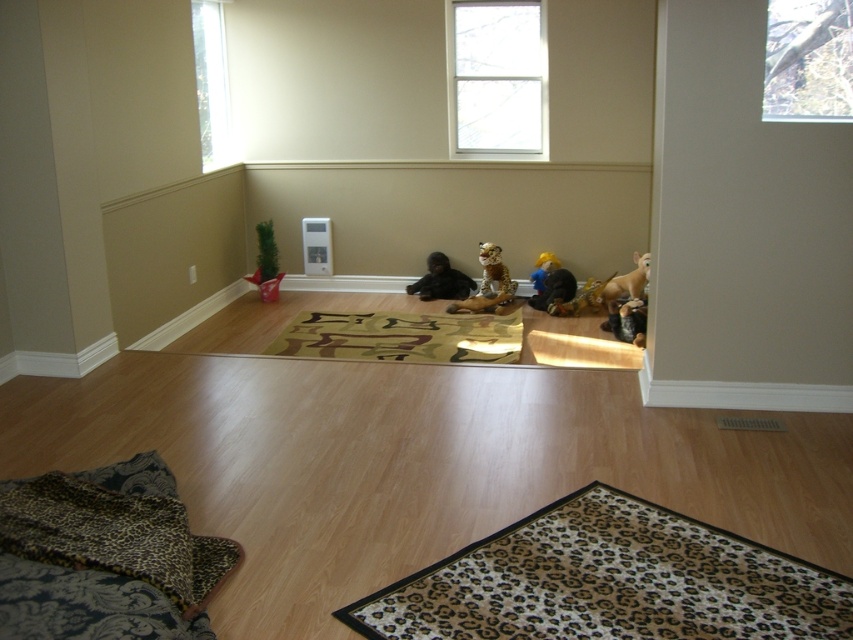
Does leopard print fabric at lower left have a lesser width compared to plush yellow bear at center?

In fact, leopard print fabric at lower left might be wider than plush yellow bear at center.

Who is more forward, [84,540] or [553,262]?

Point [84,540] is more forward.

Where is `leopard print fabric at lower left`? leopard print fabric at lower left is located at coordinates (103, 556).

Image resolution: width=853 pixels, height=640 pixels. Identify the location of clear glass window at upper left. (212, 83).

Which is below, clear glass window at upper left or leopard print plush toy at center?

leopard print plush toy at center is lower down.

Image resolution: width=853 pixels, height=640 pixels. I want to click on clear glass window at upper left, so click(x=212, y=83).

Can you confirm if leopard print fabric at lower left is positioned to the left of black plush monkey at center?

Correct, you'll find leopard print fabric at lower left to the left of black plush monkey at center.

Locate an element on the screen. leopard print fabric at lower left is located at coordinates (103, 556).

At what (x,y) coordinates should I click in order to perform the action: click on leopard print fabric at lower left. Please return your answer as a coordinate pair (x, y). The width and height of the screenshot is (853, 640). Looking at the image, I should click on click(x=103, y=556).